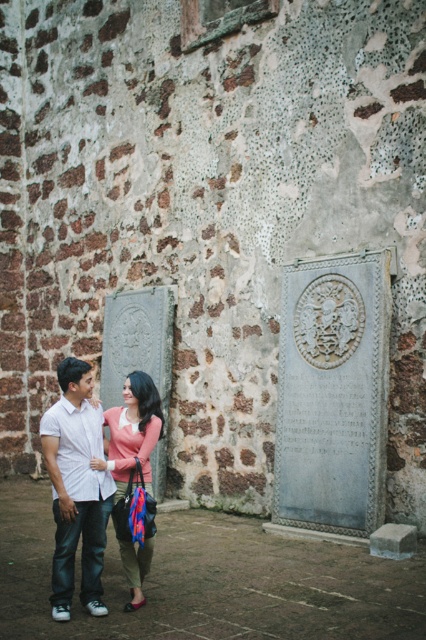
Based on the scene description, can you determine which clothing item is positioned higher on the person wearing them? The white cotton shirt at center and the pink matte sweater at center are both visible in the image.

The white cotton shirt at center is located above the pink matte sweater at center, so the white cotton shirt at center is positioned higher.

You are a photographer trying to capture a clear photo of the white cotton shirt at center and the pink matte sweater at center. Since both are at the center, which one is blocking the other from view?

The white cotton shirt at center is in front of the pink matte sweater at center, so it is blocking the view of the pink matte sweater at center.

You are a photographer trying to capture a clear shot of both the white cotton shirt at center and the pink matte sweater at center. Since you want to ensure both are fully visible in the frame, which clothing item should you focus on first to adjust your camera angle?

The white cotton shirt at center is much taller than the pink matte sweater at center, so you should focus on adjusting the camera angle to include the taller white cotton shirt at center first to ensure both are visible.